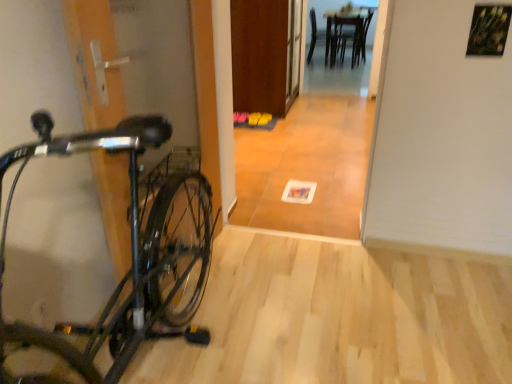
Question: Looking at the image, does wooden table at center seem bigger or smaller compared to wooden floor at center?

Choices:
 (A) small
 (B) big

Answer: (B)

Question: Does point (364, 52) appear closer or farther from the camera than point (358, 183)?

Choices:
 (A) closer
 (B) farther

Answer: (B)

Question: Which is nearer to the wooden table at center?

Choices:
 (A) wooden floor at center
 (B) wooden door at center
 (C) wooden chair at center
 (D) shiny black bicycle at left

Answer: (C)

Question: Estimate the real-world distances between objects in this image. Which object is farther from the wooden floor at center?

Choices:
 (A) wooden door at center
 (B) wooden table at center
 (C) wooden chair at center
 (D) shiny black bicycle at left

Answer: (C)